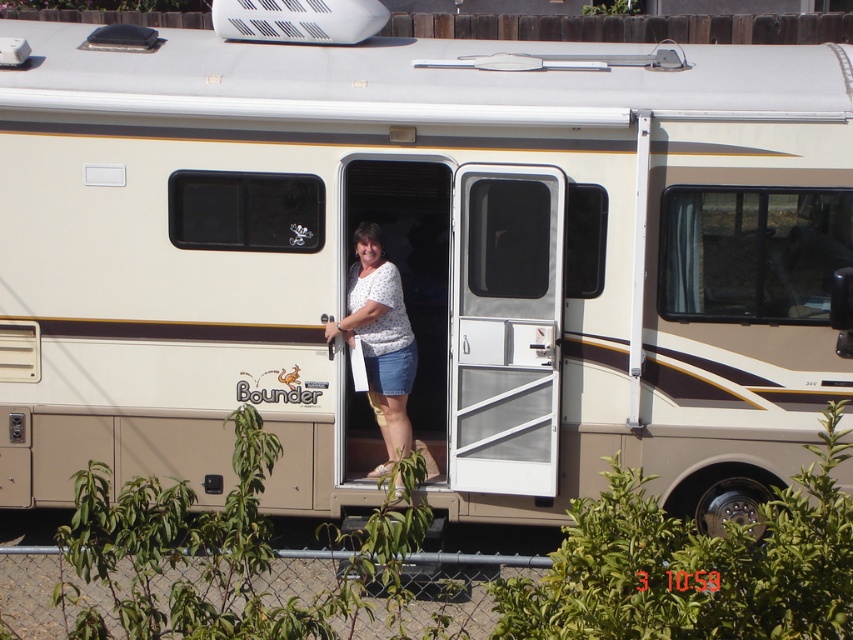
You are a delivery person trying to hand a package to the woman standing at the RV door. The package is 24 inches long. Can you slide the package between the white plastic door at center and the white dotted shirt at center without bending it?

The distance between the white plastic door at center and the white dotted shirt at center is 22.88 inches. Since the package is 24 inches long, it is longer than the available space. Therefore, you cannot slide the package between them without bending it.

You are a delivery person trying to hand a package to the woman at the RV door. The package is too large to fit through the door. Which object, the white plastic door at center or the white dotted shirt at center, is the reason you can not deliver the package?

The white plastic door at center is smaller than the white dotted shirt at center, so the white plastic door at center is too small for the package to pass through.